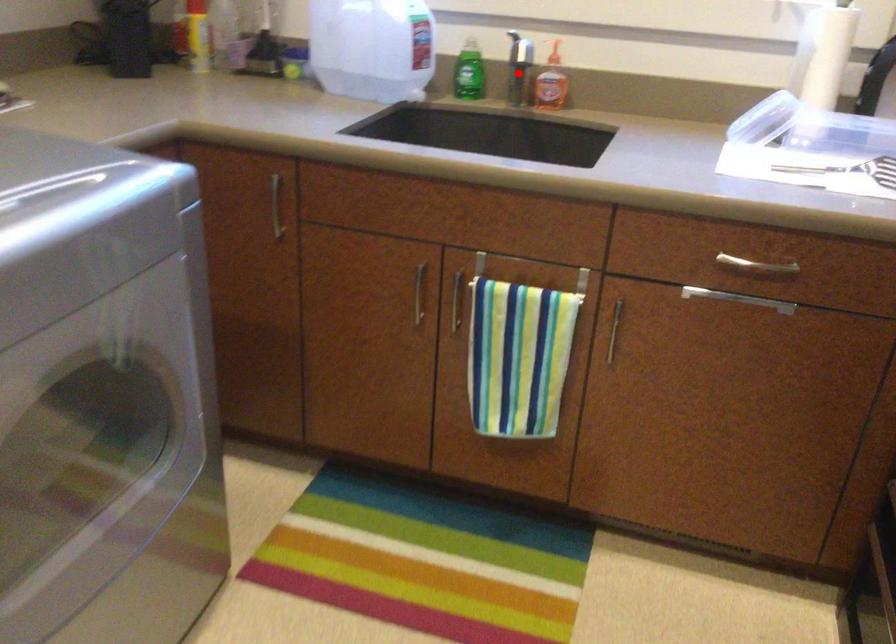
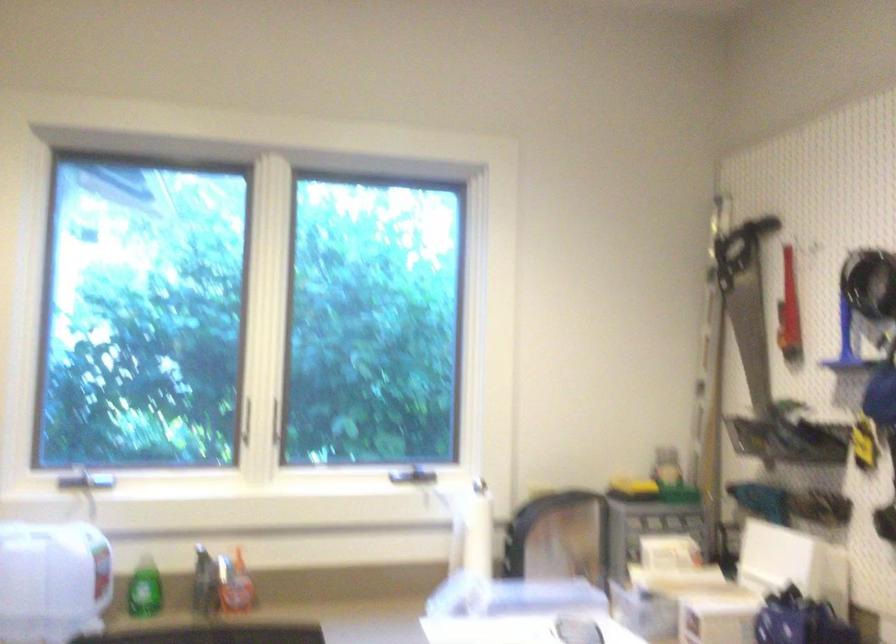
Question: I am providing you with two images of the same scene from different viewpoints. A red point is marked on the first image. Is the red point's position out of view in image 2?

Choices:
 (A) Yes
 (B) No

Answer: (B)